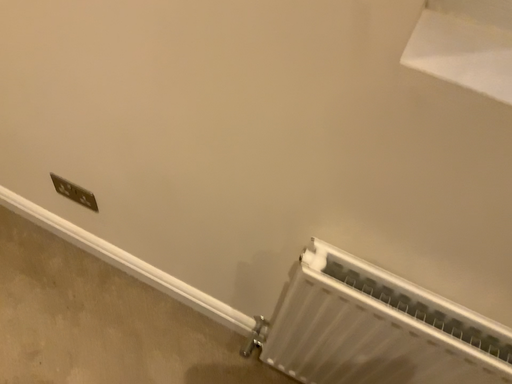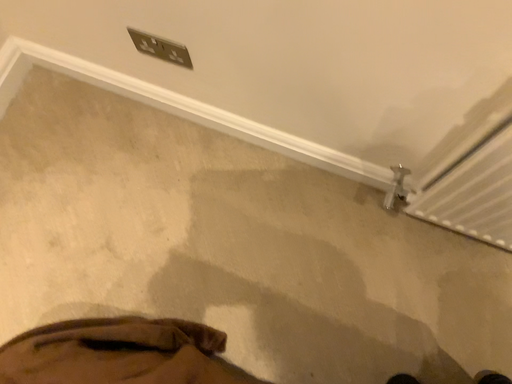
Question: Which way did the camera rotate in the video?

Choices:
 (A) rotated upward
 (B) rotated downward

Answer: (B)